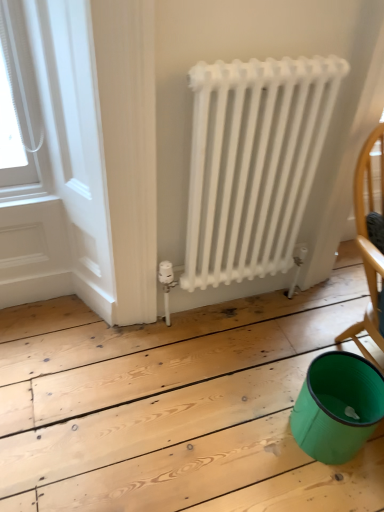
Question: Considering the relative sizes of white matte radiator at center and white painted wood at upper left in the image provided, is white matte radiator at center thinner than white painted wood at upper left?

Choices:
 (A) yes
 (B) no

Answer: (B)

Question: Could you tell me if white matte radiator at center is facing white painted wood at upper left?

Choices:
 (A) yes
 (B) no

Answer: (B)

Question: Does white matte radiator at center have a smaller size compared to white painted wood at upper left?

Choices:
 (A) yes
 (B) no

Answer: (B)

Question: Does white matte radiator at center contain white painted wood at upper left?

Choices:
 (A) yes
 (B) no

Answer: (B)

Question: Is white matte radiator at center not near white painted wood at upper left?

Choices:
 (A) no
 (B) yes

Answer: (A)

Question: Considering the positions of white matte radiator at center and wooden chair at right in the image, is white matte radiator at center taller or shorter than wooden chair at right?

Choices:
 (A) short
 (B) tall

Answer: (B)

Question: Is white matte radiator at center bigger or smaller than wooden chair at right?

Choices:
 (A) big
 (B) small

Answer: (A)

Question: Is white matte radiator at center wider or thinner than wooden chair at right?

Choices:
 (A) thin
 (B) wide

Answer: (A)

Question: Does point (188, 282) appear closer or farther from the camera than point (377, 291)?

Choices:
 (A) closer
 (B) farther

Answer: (A)

Question: Is point (370, 412) positioned closer to the camera than point (362, 252)?

Choices:
 (A) closer
 (B) farther

Answer: (A)

Question: Would you say teal plastic bucket at lower right is inside or outside wooden chair at right?

Choices:
 (A) inside
 (B) outside

Answer: (B)

Question: In terms of size, does teal plastic bucket at lower right appear bigger or smaller than wooden chair at right?

Choices:
 (A) big
 (B) small

Answer: (A)

Question: Considering the positions of teal plastic bucket at lower right and wooden chair at right in the image, is teal plastic bucket at lower right wider or thinner than wooden chair at right?

Choices:
 (A) wide
 (B) thin

Answer: (A)

Question: In terms of height, does teal plastic bucket at lower right look taller or shorter compared to white painted wood at upper left?

Choices:
 (A) short
 (B) tall

Answer: (A)

Question: From a real-world perspective, relative to white painted wood at upper left, is teal plastic bucket at lower right vertically above or below?

Choices:
 (A) below
 (B) above

Answer: (A)